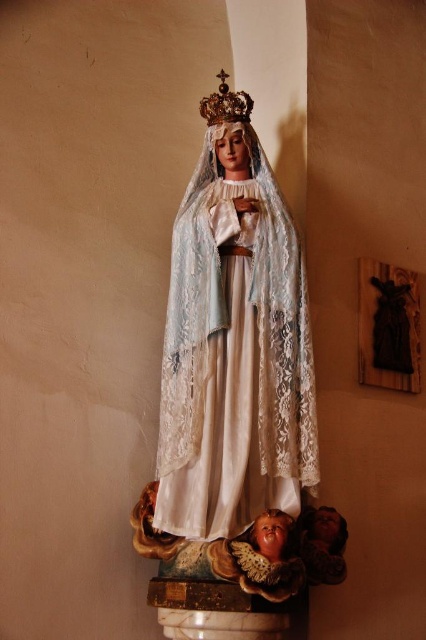
Question: Does white lace statue at center have a smaller size compared to gold metallic crown at upper center?

Choices:
 (A) yes
 (B) no

Answer: (B)

Question: Can you confirm if white lace statue at center is wider than gold metallic crown at upper center?

Choices:
 (A) no
 (B) yes

Answer: (B)

Question: Among these points, which one is nearest to the camera?

Choices:
 (A) (189, 566)
 (B) (230, 104)

Answer: (A)

Question: Which of the following is the farthest from the observer?

Choices:
 (A) white lace statue at center
 (B) gold metallic crown at upper center

Answer: (B)

Question: Does white lace statue at center appear under gold metallic crown at upper center?

Choices:
 (A) no
 (B) yes

Answer: (B)

Question: Which point is closer to the camera?

Choices:
 (A) (203, 115)
 (B) (305, 301)

Answer: (B)